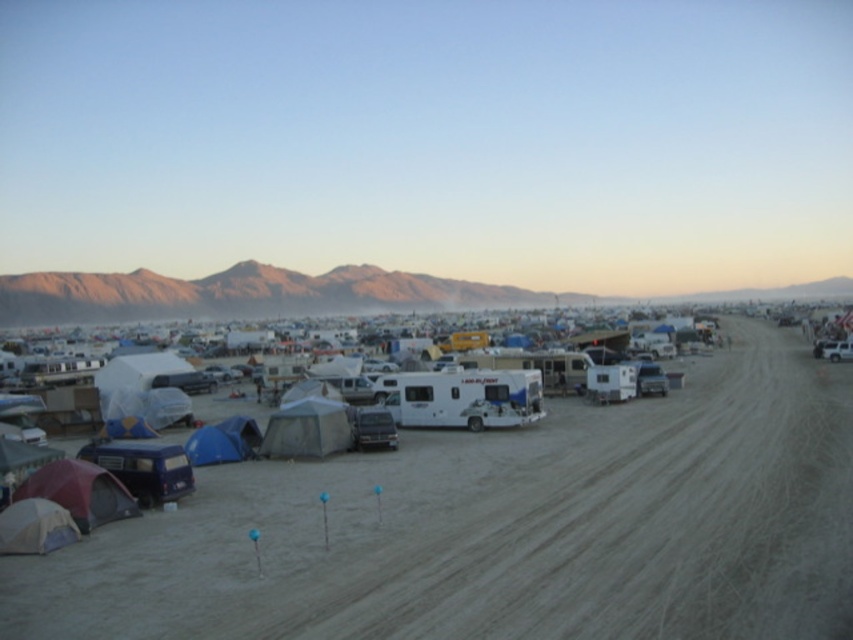
Question: Considering the real-world distances, which object is closest to the dusty sand dirt field at center?

Choices:
 (A) blue matte van at lower left
 (B) gray fabric tent at center
 (C) white matte tent at lower left
 (D) white matte recreational vehicle at center

Answer: (C)

Question: Is golden sandstone mountains at upper center above maroon fabric tent at lower left?

Choices:
 (A) no
 (B) yes

Answer: (B)

Question: Is dusty sand dirt field at center wider than blue fabric tent at lower left?

Choices:
 (A) yes
 (B) no

Answer: (A)

Question: Which point is farther to the camera?

Choices:
 (A) white matte tent at lower left
 (B) blue matte van at lower left
 (C) white matte camper at center

Answer: (C)

Question: Which point is closer to the camera?

Choices:
 (A) blue fabric tent at lower left
 (B) blue matte van at lower left
 (C) gray fabric tent at center
 (D) dusty sand dirt field at center

Answer: (D)

Question: Is blue matte van at lower left above white matte recreational vehicle at center?

Choices:
 (A) no
 (B) yes

Answer: (A)